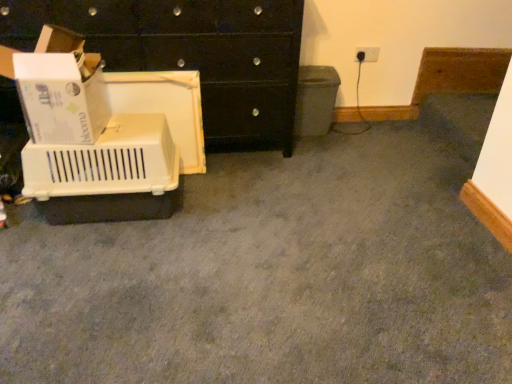
This screenshot has height=384, width=512. Describe the element at coordinates (106, 161) in the screenshot. I see `beige plastic crate at left` at that location.

Locate an element on the screen. The image size is (512, 384). beige plastic crate at left is located at coordinates (106, 161).

Is black glossy chest of drawers at upper left directly adjacent to white cardboard box at left?

There is a gap between black glossy chest of drawers at upper left and white cardboard box at left.

Is black glossy chest of drawers at upper left turned away from white cardboard box at left?

Yes.

Between black glossy chest of drawers at upper left and white cardboard box at left, which one has smaller width?

Thinner between the two is white cardboard box at left.

Is white cardboard box at left surrounded by black glossy chest of drawers at upper left?

No, white cardboard box at left is located outside of black glossy chest of drawers at upper left.

Consider the image. Is matte gray recycling bin at center-right inside or outside of white plastic electric outlet at upper right?

matte gray recycling bin at center-right lies outside white plastic electric outlet at upper right.

The height and width of the screenshot is (384, 512). I want to click on electric outlet on the right of matte gray recycling bin at center-right, so click(367, 54).

From a real-world perspective, is matte gray recycling bin at center-right above or below white plastic electric outlet at upper right?

Clearly, from a real-world perspective, matte gray recycling bin at center-right is below white plastic electric outlet at upper right.

Is matte gray recycling bin at center-right oriented towards white plastic electric outlet at upper right?

No, matte gray recycling bin at center-right is not facing towards white plastic electric outlet at upper right.

In the scene shown: How many degrees apart are the facing directions of beige plastic crate at left and white plastic electric outlet at upper right?

There is a 1.1-degree angle between the facing directions of beige plastic crate at left and white plastic electric outlet at upper right.

Is point (22, 166) positioned behind point (357, 61)?

No, (22, 166) is closer to viewer.

Considering the sizes of beige plastic crate at left and white plastic electric outlet at upper right in the image, is beige plastic crate at left bigger or smaller than white plastic electric outlet at upper right?

Considering their sizes, beige plastic crate at left takes up more space than white plastic electric outlet at upper right.

Is white plastic electric outlet at upper right inside or outside of matte gray recycling bin at center-right?

white plastic electric outlet at upper right is spatially situated outside matte gray recycling bin at center-right.

From the image's perspective, which is above, white plastic electric outlet at upper right or matte gray recycling bin at center-right?

white plastic electric outlet at upper right appears higher in the image.

Considering their positions, is white plastic electric outlet at upper right located in front of or behind white cardboard box at left?

white plastic electric outlet at upper right is positioned farther from the viewer than white cardboard box at left.

Between point (365, 59) and point (36, 86), which one is positioned in front?

The point (36, 86) is more forward.

Would you say white plastic electric outlet at upper right is a long distance from white cardboard box at left?

Absolutely, white plastic electric outlet at upper right is distant from white cardboard box at left.

Between white plastic electric outlet at upper right and white cardboard box at left, which one appears on the left side from the viewer's perspective?

white cardboard box at left.

Does beige plastic crate at left lie behind matte gray recycling bin at center-right?

No, the depth of beige plastic crate at left is less than that of matte gray recycling bin at center-right.

Does beige plastic crate at left touch matte gray recycling bin at center-right?

beige plastic crate at left and matte gray recycling bin at center-right are not in contact.

From a real-world perspective, is beige plastic crate at left above or below matte gray recycling bin at center-right?

beige plastic crate at left is situated lower than matte gray recycling bin at center-right in the real world.

Which object is wider, beige plastic crate at left or matte gray recycling bin at center-right?

beige plastic crate at left.

Does white cardboard box at left lie in front of matte gray recycling bin at center-right?

Yes, white cardboard box at left is in front of matte gray recycling bin at center-right.

Which is correct: white cardboard box at left is inside matte gray recycling bin at center-right, or outside of it?

white cardboard box at left exists outside the volume of matte gray recycling bin at center-right.

From the image's perspective, would you say white cardboard box at left is shown under matte gray recycling bin at center-right?

Yes.

Does white cardboard box at left have a lesser width compared to matte gray recycling bin at center-right?

No, white cardboard box at left is not thinner than matte gray recycling bin at center-right.

Identify the location of chest of drawers on the right of the white cardboard box at left. (194, 55).

What are the coordinates of `recycling bin that is below the white plastic electric outlet at upper right (from the image's perspective)` in the screenshot? It's located at (315, 100).

Which object lies further to the anchor point white plastic electric outlet at upper right, black glossy chest of drawers at upper left or beige plastic crate at left?

The object further to white plastic electric outlet at upper right is beige plastic crate at left.

Looking at the image, which one is located further to black glossy chest of drawers at upper left, white cardboard box at left or white plastic electric outlet at upper right?

white plastic electric outlet at upper right lies further to black glossy chest of drawers at upper left than the other object.

From the image, which object appears to be farther from black glossy chest of drawers at upper left, beige plastic crate at left or white cardboard box at left?

The object further to black glossy chest of drawers at upper left is beige plastic crate at left.

Estimate the real-world distances between objects in this image. Which object is further from beige plastic crate at left, white plastic electric outlet at upper right or white cardboard box at left?

white plastic electric outlet at upper right lies further to beige plastic crate at left than the other object.

Estimate the real-world distances between objects in this image. Which object is closer to matte gray recycling bin at center-right, black glossy chest of drawers at upper left or white plastic electric outlet at upper right?

white plastic electric outlet at upper right is closer to matte gray recycling bin at center-right.

When comparing their distances from white cardboard box at left, does beige plastic crate at left or white plastic electric outlet at upper right seem further?

white plastic electric outlet at upper right.

Based on their spatial positions, is beige plastic crate at left or matte gray recycling bin at center-right further from white plastic electric outlet at upper right?

beige plastic crate at left.

Considering their positions, is beige plastic crate at left positioned further to white plastic electric outlet at upper right than black glossy chest of drawers at upper left?

beige plastic crate at left is positioned further to the anchor white plastic electric outlet at upper right.

In order to click on cardboard box between black glossy chest of drawers at upper left and beige plastic crate at left in the up-down direction in this screenshot , I will do `click(59, 88)`.

Locate an element on the screen. recycling bin between black glossy chest of drawers at upper left and white plastic electric outlet at upper right is located at coordinates (315, 100).

Find the location of a particular element. This screenshot has width=512, height=384. recycling bin located between white cardboard box at left and white plastic electric outlet at upper right in the left-right direction is located at coordinates (315, 100).

Locate an element on the screen. chest of drawers between white cardboard box at left and white plastic electric outlet at upper right from left to right is located at coordinates (194, 55).